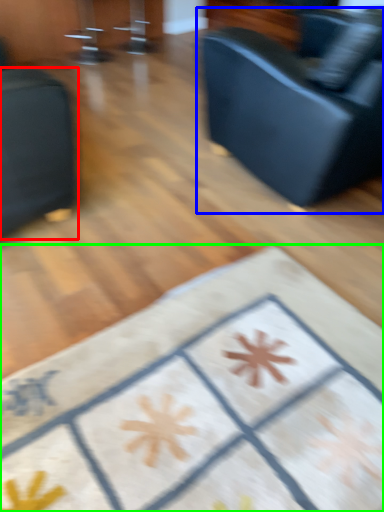
Question: Which object is the farthest from furniture (highlighted by a red box)? Choose among these: studio couch (highlighted by a blue box) or furniture (highlighted by a green box).

Choices:
 (A) studio couch
 (B) furniture

Answer: (A)